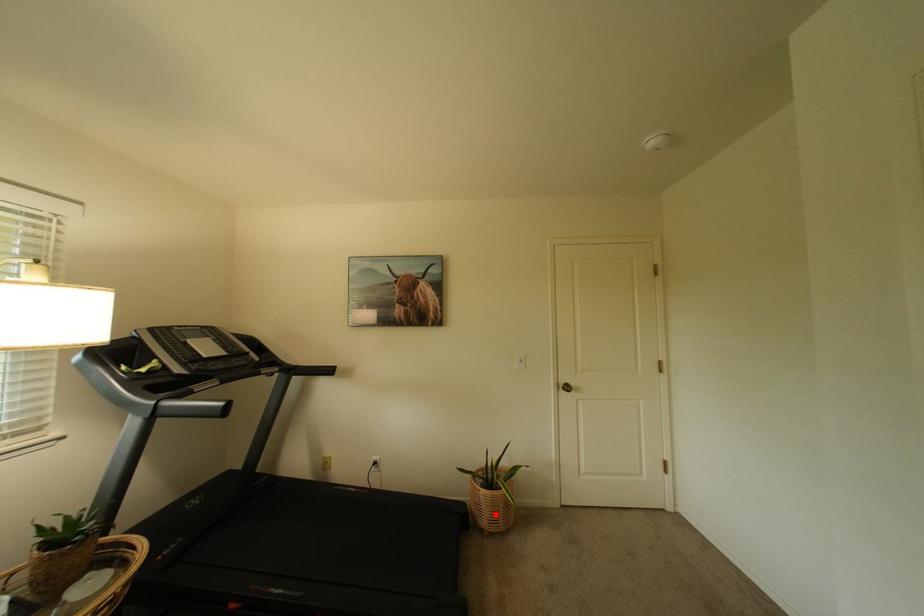
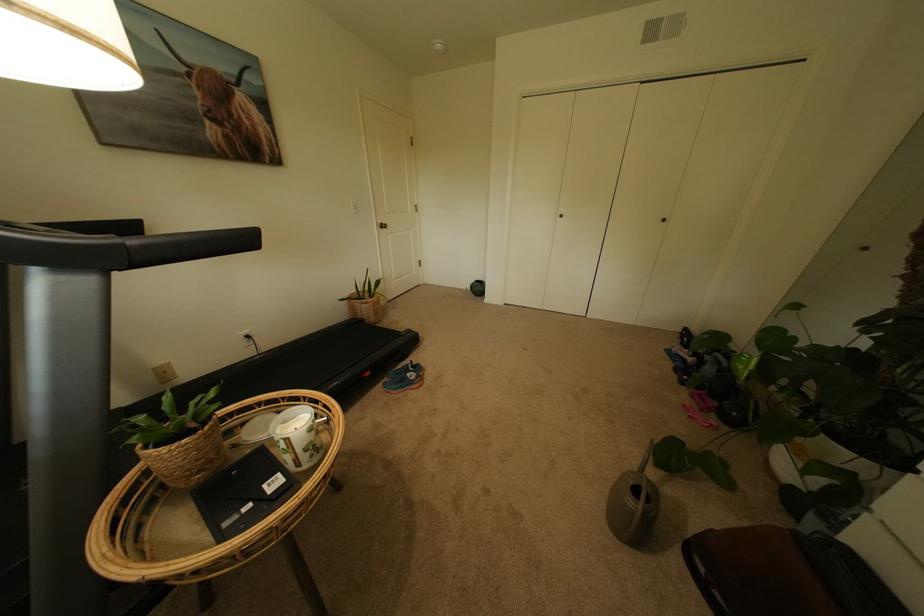
Where in the second image is the point corresponding to the highlighted location from the first image?

(382, 314)